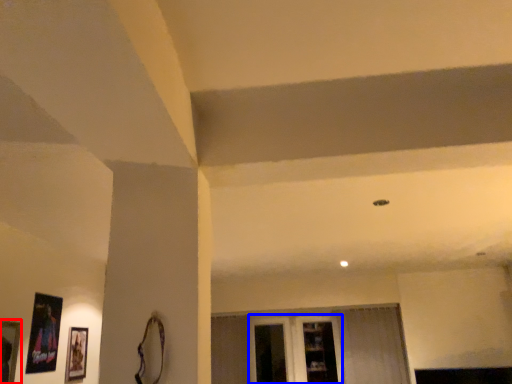
Question: Among these objects, which one is nearest to the camera, picture frame (highlighted by a red box) or glass door (highlighted by a blue box)?

Choices:
 (A) picture frame
 (B) glass door

Answer: (A)